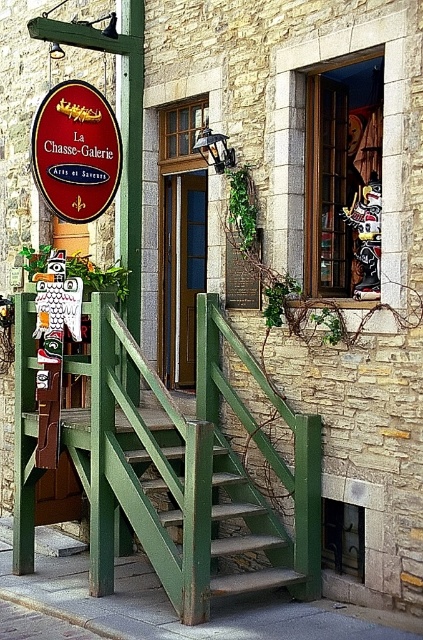
Consider the image. Measure the distance between point (266,560) and camera.

They are 6.13 meters apart.

Which is in front, point (181, 497) or point (47, 150)?

Point (181, 497) is more forward.

Is point (250, 552) closer to viewer compared to point (80, 208)?

Yes, point (250, 552) is in front of point (80, 208).

The image size is (423, 640). In order to click on green wooden stairs at center in this screenshot , I will do `click(153, 484)`.

Is green wood rail at center above matte red sign at upper left?

Actually, green wood rail at center is below matte red sign at upper left.

Is point (170, 573) in front of point (65, 186)?

Yes.

Identify the location of green wood rail at center. The image size is (423, 640). pyautogui.click(x=189, y=472).

Between green wood rail at center and green wooden stairs at center, which one appears on the right side from the viewer's perspective?

Positioned to the right is green wood rail at center.

How much distance is there between green wood rail at center and green wooden stairs at center?

green wood rail at center is 14.81 centimeters from green wooden stairs at center.

Measure the distance between green wood rail at center and camera.

green wood rail at center is 5.12 meters away from camera.

Find the location of a particular element. Image resolution: width=423 pixels, height=640 pixels. green wood rail at center is located at coordinates (189, 472).